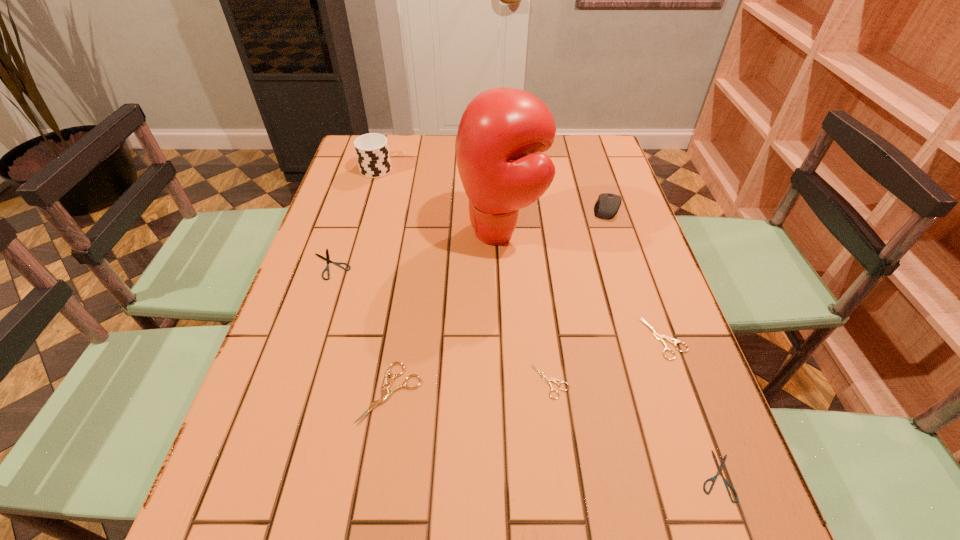
Locate an element on the screen. the tallest object is located at coordinates (502, 129).

Locate an element on the screen. boxing glove is located at coordinates pos(502,129).

Locate an element on the screen. This screenshot has height=540, width=960. black cup is located at coordinates (372, 151).

Where is `the farthest object`? Image resolution: width=960 pixels, height=540 pixels. the farthest object is located at coordinates (372, 151).

You are a GUI agent. You are given a task and a screenshot of the screen. Output one action in this format:
    pyautogui.click(x=<x>, y=<y>)
    Task: Click on the black computer equipment
    This screenshot has width=960, height=540.
    Given the screenshot: What is the action you would take?
    pyautogui.click(x=608, y=204)

You are a GUI agent. You are given a task and a screenshot of the screen. Output one action in this format:
    pyautogui.click(x=<x>, y=<y>)
    Task: Click on the computer equipment
    
    Given the screenshot: What is the action you would take?
    pyautogui.click(x=608, y=204)

This screenshot has width=960, height=540. I want to click on the fourth shears from right to left, so click(386, 394).

Find the location of a particular element. The width and height of the screenshot is (960, 540). the leftmost beige shears is located at coordinates (386, 394).

Find the location of a particular element. Image resolution: width=960 pixels, height=540 pixels. the fourth shortest object is located at coordinates (661, 338).

Identify the location of the second tallest shears. (661, 338).